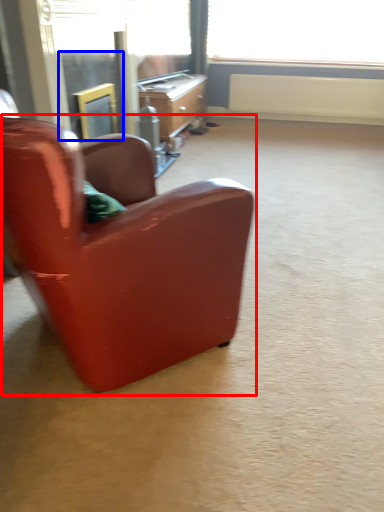
Question: Among these objects, which one is nearest to the camera, chair (highlighted by a red box) or screen door (highlighted by a blue box)?

Choices:
 (A) chair
 (B) screen door

Answer: (A)